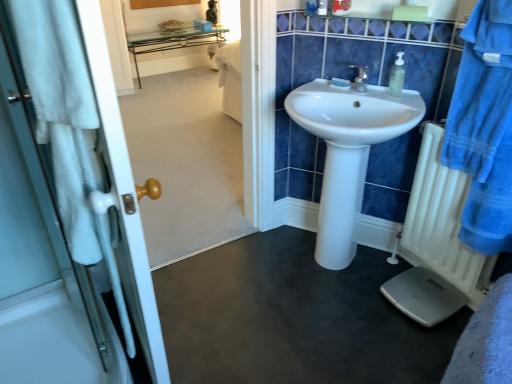
Question: Is blue glossy tiles at upper center facing towards white plastic radiator at right?

Choices:
 (A) no
 (B) yes

Answer: (A)

Question: Is the position of blue glossy tiles at upper center less distant than that of white plastic radiator at right?

Choices:
 (A) yes
 (B) no

Answer: (B)

Question: Can you confirm if blue glossy tiles at upper center is wider than white plastic radiator at right?

Choices:
 (A) no
 (B) yes

Answer: (B)

Question: Would you say blue glossy tiles at upper center contains white plastic radiator at right?

Choices:
 (A) no
 (B) yes

Answer: (A)

Question: From the image's perspective, is blue glossy tiles at upper center beneath white plastic radiator at right?

Choices:
 (A) yes
 (B) no

Answer: (B)

Question: Can you confirm if blue glossy tiles at upper center is taller than white plastic radiator at right?

Choices:
 (A) no
 (B) yes

Answer: (A)

Question: Is transparent plastic soap at center located outside white plastic radiator at right?

Choices:
 (A) no
 (B) yes

Answer: (B)

Question: From a real-world perspective, is transparent plastic soap at center on white plastic radiator at right?

Choices:
 (A) yes
 (B) no

Answer: (A)

Question: Does transparent plastic soap at center appear on the left side of white plastic radiator at right?

Choices:
 (A) yes
 (B) no

Answer: (A)

Question: Can you confirm if transparent plastic soap at center is shorter than white plastic radiator at right?

Choices:
 (A) no
 (B) yes

Answer: (B)

Question: Considering the relative sizes of transparent plastic soap at center and white plastic radiator at right in the image provided, is transparent plastic soap at center wider than white plastic radiator at right?

Choices:
 (A) yes
 (B) no

Answer: (B)

Question: Is transparent plastic soap at center positioned far away from white plastic radiator at right?

Choices:
 (A) yes
 (B) no

Answer: (B)

Question: From the image's perspective, is smooth white scale at center under blue cotton bathrobe at right?

Choices:
 (A) no
 (B) yes

Answer: (B)